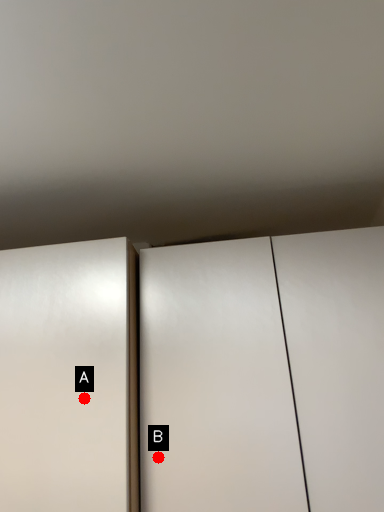
Question: Two points are circled on the image, labeled by A and B beside each circle. Which point is farther from the camera taking this photo?

Choices:
 (A) A is further
 (B) B is further

Answer: (B)